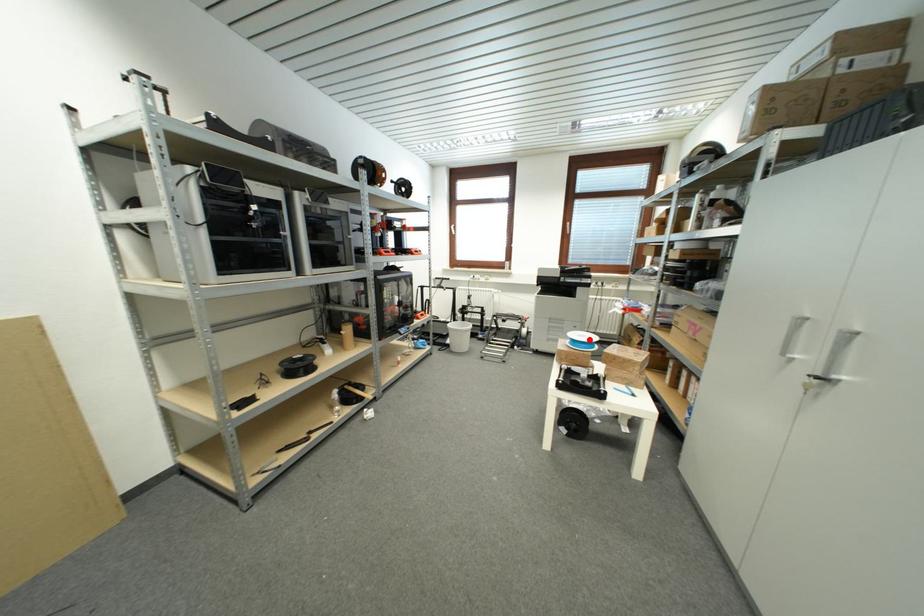
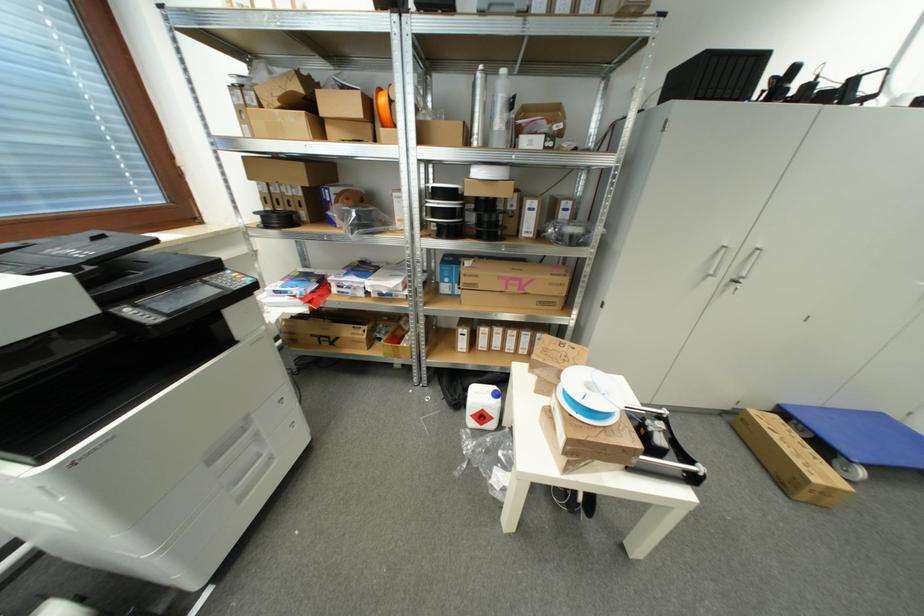
Question: A red point is marked in image1. In image2, is the corresponding 3D point closer to the camera or farther? Reply with the corresponding letter.

Choices:
 (A) The corresponding 3D point is closer.
 (B) The corresponding 3D point is farther.

Answer: (B)